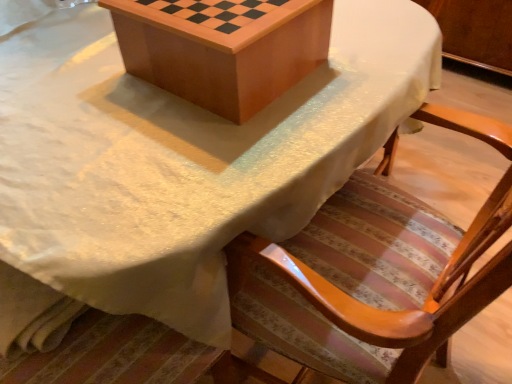
Identify the location of wooden chessboard at upper center. point(224,54).

The image size is (512, 384). Describe the element at coordinates (224, 54) in the screenshot. I see `wooden chessboard at upper center` at that location.

Image resolution: width=512 pixels, height=384 pixels. Find the location of `wooden chessboard at upper center`. wooden chessboard at upper center is located at coordinates click(x=224, y=54).